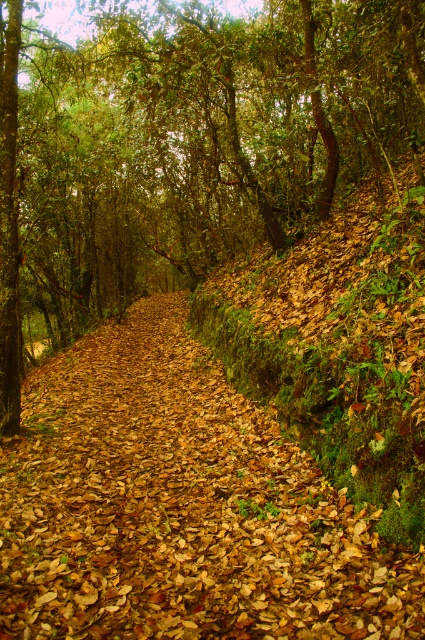
You are a hiker walking along the brown leafy forest path at center and want to take a photo of the green leafy tree at center. Which direction should you face to ensure the tree is fully visible in your camera frame?

The green leafy tree at center is positioned over the brown leafy forest path at center, so you should face upward to ensure the tree is fully visible in your camera frame.

You are standing on the forest path and want to walk from the point at coordinates point (x=68, y=189) to the point at coordinates point (x=96, y=577). Which direction should you face to move towards the second point?

Since point (x=68, y=189) is further to the camera than point (x=96, y=577), you should face away from the camera to move towards point (x=96, y=577).